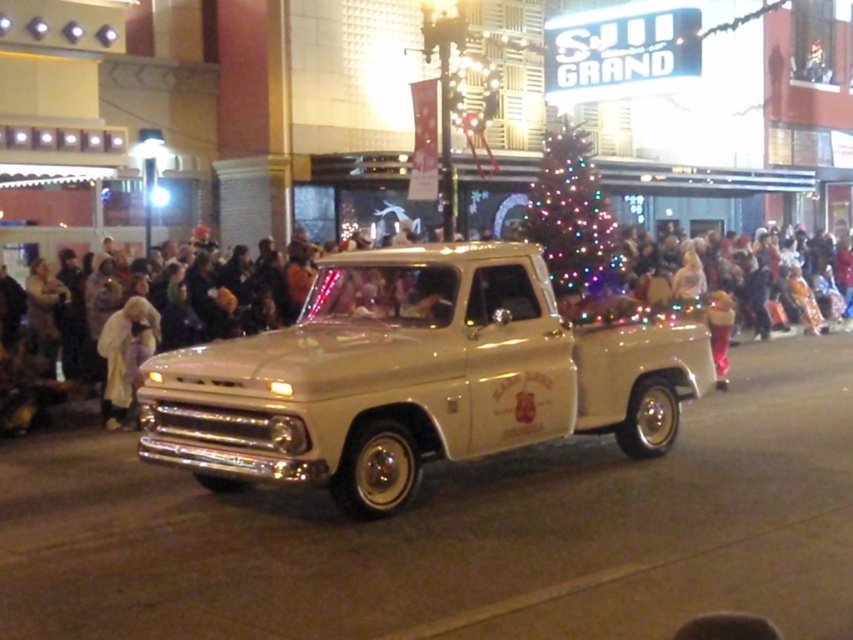
You are standing at the point marked as point (637, 355) in the image. What object is located at that point?

The object located at point 0.546, 0.748 is the white fabric crowd at center.